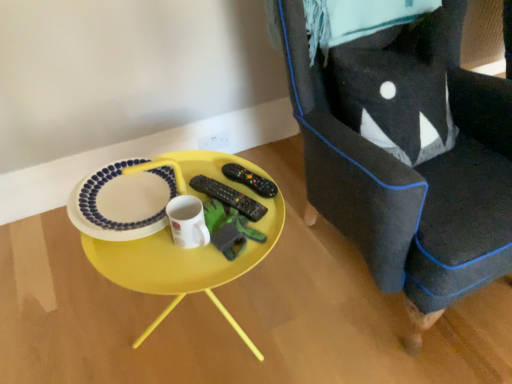
Question: Considering the relative positions of yellow plastic table at center and white glossy platter at center in the image provided, is yellow plastic table at center to the left or to the right of white glossy platter at center?

Choices:
 (A) left
 (B) right

Answer: (B)

Question: Looking at their shapes, would you say yellow plastic table at center is wider or thinner than white glossy platter at center?

Choices:
 (A) thin
 (B) wide

Answer: (B)

Question: Based on their relative distances, which object is farther from the velvet dark blue armchair at right?

Choices:
 (A) black matte remote control at center, the 1th remote control from the left
 (B) white glossy platter at center
 (C) black plastic remote control at center, the first remote control positioned from the right
 (D) yellow plastic table at center
 (E) white glossy mug at center

Answer: (E)

Question: Considering the real-world distances, which object is closest to the green felt toy at center?

Choices:
 (A) white glossy mug at center
 (B) yellow plastic table at center
 (C) white glossy platter at center
 (D) black plastic remote control at center, the 2th remote control in the left-to-right sequence
 (E) velvet dark blue armchair at right

Answer: (A)